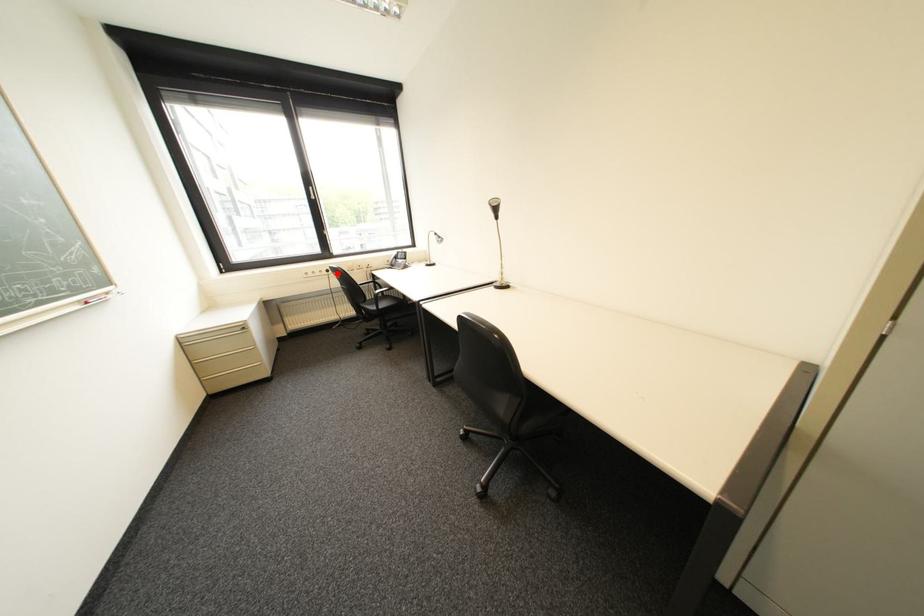
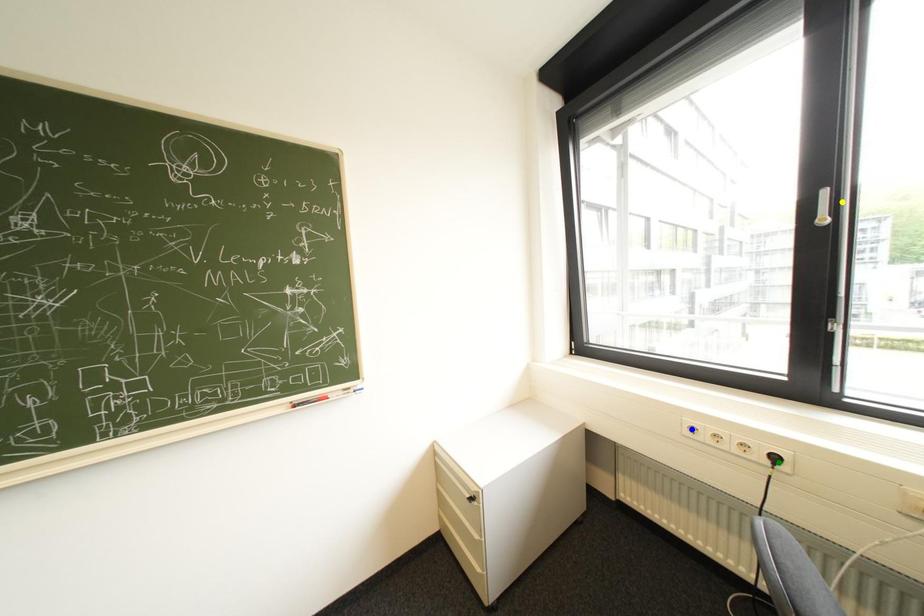
Question: I am providing you with two images of the same scene from different viewpoints. A red point is marked on the first image. You are given multiple points on the second image. In image 2, which mark is for the same physical point as the one in image 1?

Choices:
 (A) blue point
 (B) green point
 (C) yellow point

Answer: (B)